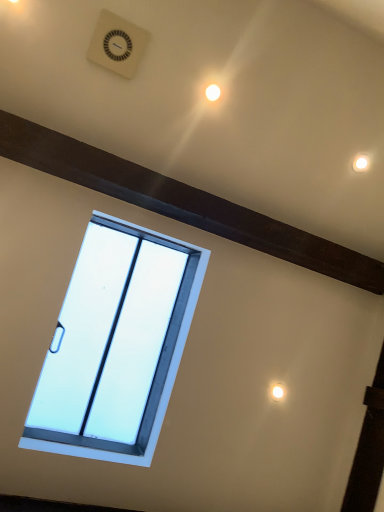
What do you see at coordinates (117, 44) in the screenshot? I see `white plastic clock at upper center` at bounding box center [117, 44].

I want to click on white glossy light at upper center, so click(212, 92).

How far apart are white plastic window at center and white plastic clock at upper center?

white plastic window at center is 1.05 meters away from white plastic clock at upper center.

What's the angular difference between white plastic window at center and white plastic clock at upper center's facing directions?

They differ by 179 degrees in their facing directions.

Looking at their sizes, would you say white plastic window at center is wider or thinner than white plastic clock at upper center?

Considering their sizes, white plastic window at center looks broader than white plastic clock at upper center.

Which of these two, white plastic window at center or white plastic clock at upper center, is smaller?

With smaller size is white plastic clock at upper center.

Does point (213, 98) lie behind point (96, 351)?

That is False.

Considering the relative positions of white glossy light at upper center and white plastic window at center in the image provided, is white glossy light at upper center behind white plastic window at center?

Yes, it is.

Considering the relative positions of white glossy light at upper center and white plastic window at center in the image provided, is white glossy light at upper center to the left or to the right of white plastic window at center?

Based on their positions, white glossy light at upper center is located to the right of white plastic window at center.

Considering the sizes of objects white glossy light at upper center and white plastic window at center in the image provided, who is bigger, white glossy light at upper center or white plastic window at center?

white plastic window at center is bigger.

Which object is positioned more to the left, white glossy light at upper center or white plastic clock at upper center?

white plastic clock at upper center is more to the left.

Is white glossy light at upper center in front of white plastic clock at upper center?

No, white glossy light at upper center is further to the viewer.

From the image's perspective, is white glossy light at upper center over white plastic clock at upper center?

No, from the image's perspective, white glossy light at upper center is not above white plastic clock at upper center.

How different are the orientations of white glossy light at upper center and white plastic clock at upper center in degrees?

2.43 degrees.

Which point is more forward, (98, 27) or (131, 240)?

Point (98, 27)

Is white plastic clock at upper center facing towards white plastic window at center?

No, white plastic clock at upper center is not aimed at white plastic window at center.

How different are the orientations of white plastic clock at upper center and white plastic window at center in degrees?

179 degrees.

You are a GUI agent. You are given a task and a screenshot of the screen. Output one action in this format:
    pyautogui.click(x=<x>, y=<y>)
    Task: Click on the clock that is above the white plastic window at center (from the image's perspective)
    The height and width of the screenshot is (512, 384).
    Given the screenshot: What is the action you would take?
    pyautogui.click(x=117, y=44)

Which is correct: white plastic clock at upper center is inside white glossy light at upper center, or outside of it?

white plastic clock at upper center is outside white glossy light at upper center.

Does point (117, 18) come behind point (205, 91)?

No, it is not.

Which object is thinner, white plastic clock at upper center or white glossy light at upper center?

Thinner between the two is white glossy light at upper center.

From the image's perspective, is white plastic clock at upper center on top of white glossy light at upper center?

Yes, from the image's perspective, white plastic clock at upper center is above white glossy light at upper center.

Is white glossy light at upper center located within white plastic window at center?

Definitely not — white glossy light at upper center is not inside white plastic window at center.

From the image's perspective, is white plastic window at center located above or below white glossy light at upper center?

Based on their image positions, white plastic window at center is located beneath white glossy light at upper center.

How different are the orientations of white plastic window at center and white glossy light at upper center in degrees?

The facing directions of white plastic window at center and white glossy light at upper center are 177 degrees apart.

Which is nearer, (107, 389) or (213, 100)?

Clearly, point (107, 389) is more distant from the camera than point (213, 100).

Find the location of a particular element. The image size is (384, 512). window below the white plastic clock at upper center (from the image's perspective) is located at coordinates (116, 344).

Locate an element on the screen. light positioned vertically above the white plastic window at center (from a real-world perspective) is located at coordinates (212, 92).

When comparing their distances from white plastic window at center, does white glossy light at upper center or white plastic clock at upper center seem further?

white glossy light at upper center is further to white plastic window at center.

From the image, which object appears to be farther from white glossy light at upper center, white plastic clock at upper center or white plastic window at center?

white plastic window at center lies further to white glossy light at upper center than the other object.

Considering their positions, is white plastic window at center positioned further to white glossy light at upper center than white plastic clock at upper center?

The object further to white glossy light at upper center is white plastic window at center.

Which object lies further to the anchor point white plastic window at center, white plastic clock at upper center or white glossy light at upper center?

white glossy light at upper center.

Looking at the image, which one is located closer to white plastic clock at upper center, white glossy light at upper center or white plastic window at center?

The object closer to white plastic clock at upper center is white glossy light at upper center.

Based on their spatial positions, is white plastic window at center or white glossy light at upper center further from white plastic clock at upper center?

The object further to white plastic clock at upper center is white plastic window at center.

Find the location of `light between white plastic clock at upper center and white plastic window at center from top to bottom`. light between white plastic clock at upper center and white plastic window at center from top to bottom is located at coordinates tap(212, 92).